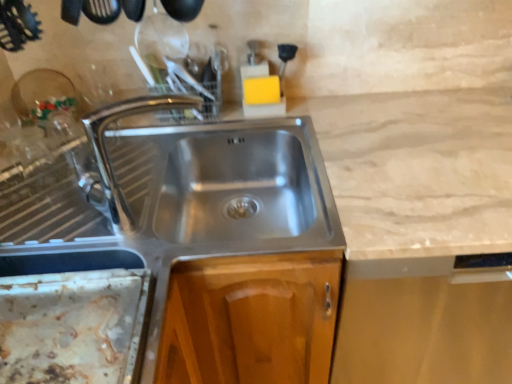
I want to click on chrome metallic tap at center, so click(x=108, y=156).

What do you see at coordinates (108, 156) in the screenshot? The height and width of the screenshot is (384, 512). I see `chrome metallic tap at center` at bounding box center [108, 156].

The height and width of the screenshot is (384, 512). Find the location of `rusty metal tray at lower left`. rusty metal tray at lower left is located at coordinates (72, 320).

Describe the element at coordinates (72, 320) in the screenshot. I see `rusty metal tray at lower left` at that location.

Locate an element on the screen. chrome metallic tap at center is located at coordinates (108, 156).

Between rusty metal tray at lower left and chrome metallic tap at center, which one appears on the left side from the viewer's perspective?

From the viewer's perspective, rusty metal tray at lower left appears more on the left side.

In the image, is rusty metal tray at lower left positioned in front of or behind chrome metallic tap at center?

rusty metal tray at lower left is in front of chrome metallic tap at center.

Considering the positions of point (115, 364) and point (179, 102), is point (115, 364) closer or farther from the camera than point (179, 102)?

Point (115, 364) appears to be closer to the viewer than point (179, 102).

From the image's perspective, is rusty metal tray at lower left below chrome metallic tap at center?

Yes, from the image's perspective, rusty metal tray at lower left is below chrome metallic tap at center.

From a real-world perspective, is rusty metal tray at lower left located higher than chrome metallic tap at center?

No, from a real-world perspective, rusty metal tray at lower left is not on top of chrome metallic tap at center.

In terms of width, does rusty metal tray at lower left look wider or thinner when compared to chrome metallic tap at center?

Clearly, rusty metal tray at lower left has more width compared to chrome metallic tap at center.

From their relative heights in the image, would you say rusty metal tray at lower left is taller or shorter than chrome metallic tap at center?

Clearly, rusty metal tray at lower left is shorter compared to chrome metallic tap at center.

Does rusty metal tray at lower left have a smaller size compared to chrome metallic tap at center?

Correct, rusty metal tray at lower left occupies less space than chrome metallic tap at center.

Is rusty metal tray at lower left located outside chrome metallic tap at center?

That's correct, rusty metal tray at lower left is outside of chrome metallic tap at center.

Based on the photo, is rusty metal tray at lower left not close to chrome metallic tap at center?

No.

From the picture: Is rusty metal tray at lower left turned away from chrome metallic tap at center?

That's not correct — rusty metal tray at lower left is not looking away from chrome metallic tap at center.

How distant is rusty metal tray at lower left from chrome metallic tap at center?

rusty metal tray at lower left and chrome metallic tap at center are 8.96 inches apart from each other.

In the image, there is a chrome metallic tap at center. At what (x,y) coordinates should I click in order to perform the action: click on appliance below it (from a real-world perspective). Please return your answer as a coordinate pair (x, y). Looking at the image, I should click on (72, 320).

Can you confirm if chrome metallic tap at center is positioned to the left of rusty metal tray at lower left?

Incorrect, chrome metallic tap at center is not on the left side of rusty metal tray at lower left.

Considering the relative positions of chrome metallic tap at center and rusty metal tray at lower left in the image provided, is chrome metallic tap at center in front of rusty metal tray at lower left?

No, it is not.

Considering the points (130, 219) and (44, 288), which point is in front, point (130, 219) or point (44, 288)?

The point (44, 288) is closer to the camera.

From the image's perspective, does chrome metallic tap at center appear higher than rusty metal tray at lower left?

Indeed, from the image's perspective, chrome metallic tap at center is shown above rusty metal tray at lower left.

From a real-world perspective, is chrome metallic tap at center positioned above or below rusty metal tray at lower left?

Clearly, from a real-world perspective, chrome metallic tap at center is above rusty metal tray at lower left.

Considering the sizes of objects chrome metallic tap at center and rusty metal tray at lower left in the image provided, who is thinner, chrome metallic tap at center or rusty metal tray at lower left?

With smaller width is chrome metallic tap at center.

Considering the sizes of chrome metallic tap at center and rusty metal tray at lower left in the image, is chrome metallic tap at center taller or shorter than rusty metal tray at lower left?

chrome metallic tap at center is taller than rusty metal tray at lower left.

Considering the sizes of objects chrome metallic tap at center and rusty metal tray at lower left in the image provided, who is bigger, chrome metallic tap at center or rusty metal tray at lower left?

chrome metallic tap at center is bigger.

Choose the correct answer: Is chrome metallic tap at center inside rusty metal tray at lower left or outside it?

chrome metallic tap at center is not enclosed by rusty metal tray at lower left.

Are chrome metallic tap at center and rusty metal tray at lower left located far from each other?

chrome metallic tap at center is near rusty metal tray at lower left, not far away.

Is chrome metallic tap at center oriented away from rusty metal tray at lower left?

chrome metallic tap at center does not have its back to rusty metal tray at lower left.

What's the angular difference between chrome metallic tap at center and rusty metal tray at lower left's facing directions?

69.2 degrees separate the facing orientations of chrome metallic tap at center and rusty metal tray at lower left.

How far apart are chrome metallic tap at center and rusty metal tray at lower left?

chrome metallic tap at center is 8.96 inches away from rusty metal tray at lower left.

I want to click on appliance in front of the chrome metallic tap at center, so click(72, 320).

Image resolution: width=512 pixels, height=384 pixels. I want to click on appliance that is under the chrome metallic tap at center (from a real-world perspective), so click(72, 320).

Find the location of a particular element. tap above the rusty metal tray at lower left (from a real-world perspective) is located at coordinates (108, 156).